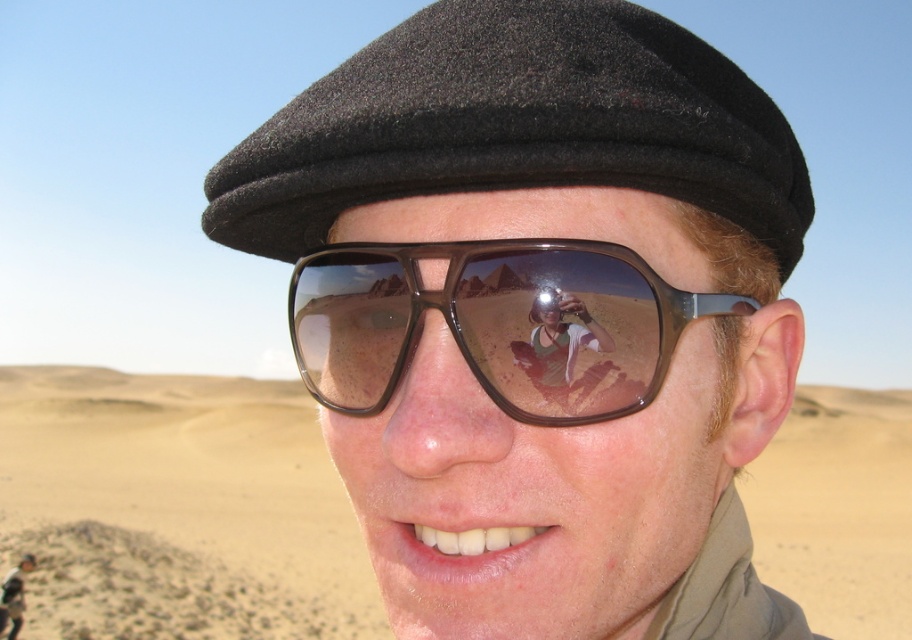
Which of these two, matte black cap at center or desert sand at lower left, stands shorter?

Standing shorter between the two is matte black cap at center.

Does matte black cap at center lie behind desert sand at lower left?

No, matte black cap at center is closer to the viewer.

Is point (772, 381) positioned before point (198, 529)?

Yes, point (772, 381) is in front of point (198, 529).

Find the location of a particular element. This screenshot has height=640, width=912. matte black cap at center is located at coordinates pyautogui.click(x=539, y=314).

Between point (495, 563) and point (483, 285), which one is positioned in front?

Point (495, 563)

Between point (716, 509) and point (348, 243), which one is positioned behind?

The point (716, 509) is more distant.

This screenshot has width=912, height=640. I want to click on matte black cap at center, so click(x=539, y=314).

Who is lower down, black woolen cap at upper center or brown plastic sunglasses at center?

Positioned lower is brown plastic sunglasses at center.

This screenshot has height=640, width=912. Describe the element at coordinates (516, 125) in the screenshot. I see `black woolen cap at upper center` at that location.

Where is `black woolen cap at upper center`? The height and width of the screenshot is (640, 912). black woolen cap at upper center is located at coordinates (516, 125).